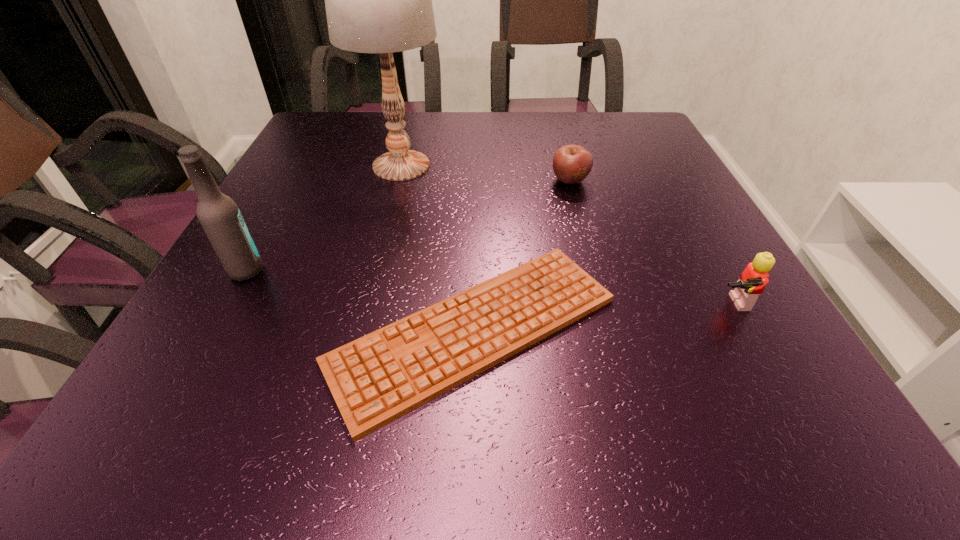
You are a GUI agent. You are given a task and a screenshot of the screen. Output one action in this format:
    pyautogui.click(x=<x>, y=<y>)
    Task: Click on the free space located on the side of the second shortest object with the unique marking
    
    Given the screenshot: What is the action you would take?
    pyautogui.click(x=583, y=228)

Find the location of a particular element. free region located on the back of the shortest object is located at coordinates (476, 196).

Locate an element on the screen. Image resolution: width=960 pixels, height=540 pixels. object located at the far edge is located at coordinates (378, 0).

Where is `object located at the near edge`? This screenshot has width=960, height=540. object located at the near edge is located at coordinates (380, 377).

Where is `object at the left edge`? object at the left edge is located at coordinates (220, 217).

Image resolution: width=960 pixels, height=540 pixels. I want to click on object at the right edge, so click(752, 281).

Locate an element on the screen. This screenshot has height=540, width=960. vacant position at the far edge of the desktop is located at coordinates (551, 122).

Find the location of `blank area at the near edge`. blank area at the near edge is located at coordinates (466, 406).

The width and height of the screenshot is (960, 540). In the image, there is a desktop. Identify the location of free region at the left edge. (270, 259).

At what (x,y) coordinates should I click in order to perform the action: click on free location at the right edge of the desktop. Please return your answer as a coordinate pair (x, y). Looking at the image, I should click on (663, 251).